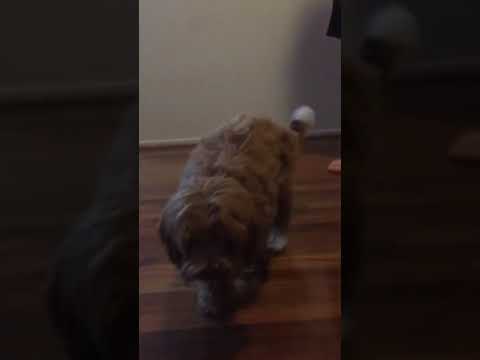
You are a GUI agent. You are given a task and a screenshot of the screen. Output one action in this format:
    pyautogui.click(x=<x>, y=<y>)
    Task: Click on the biege wall
    
    Given the screenshot: What is the action you would take?
    pyautogui.click(x=188, y=67)